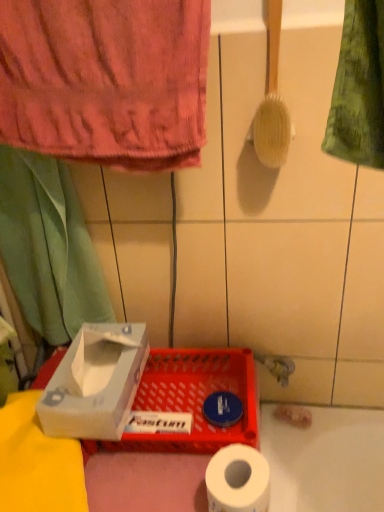
Question: Considering the relative sizes of matte plastic basket at lower center and pink cotton towel at upper left in the image provided, is matte plastic basket at lower center smaller than pink cotton towel at upper left?

Choices:
 (A) no
 (B) yes

Answer: (A)

Question: Is matte plastic basket at lower center positioned in front of pink cotton towel at upper left?

Choices:
 (A) no
 (B) yes

Answer: (A)

Question: Considering the relative sizes of matte plastic basket at lower center and pink cotton towel at upper left in the image provided, is matte plastic basket at lower center bigger than pink cotton towel at upper left?

Choices:
 (A) no
 (B) yes

Answer: (B)

Question: Is matte plastic basket at lower center aimed at pink cotton towel at upper left?

Choices:
 (A) yes
 (B) no

Answer: (B)

Question: Considering the relative sizes of matte plastic basket at lower center and pink cotton towel at upper left in the image provided, is matte plastic basket at lower center shorter than pink cotton towel at upper left?

Choices:
 (A) no
 (B) yes

Answer: (B)

Question: In terms of size, does white cardboard box at lower left appear bigger or smaller than matte plastic basket at lower center?

Choices:
 (A) small
 (B) big

Answer: (A)

Question: From the image's perspective, is white cardboard box at lower left positioned above or below matte plastic basket at lower center?

Choices:
 (A) above
 (B) below

Answer: (A)

Question: Considering the positions of white cardboard box at lower left and matte plastic basket at lower center in the image, is white cardboard box at lower left wider or thinner than matte plastic basket at lower center?

Choices:
 (A) thin
 (B) wide

Answer: (A)

Question: From a real-world perspective, is white cardboard box at lower left above or below matte plastic basket at lower center?

Choices:
 (A) above
 (B) below

Answer: (A)

Question: From the image's perspective, is pink cotton towel at upper left located above or below white matte toilet paper at lower center?

Choices:
 (A) above
 (B) below

Answer: (A)

Question: From a real-world perspective, is pink cotton towel at upper left physically located above or below white matte toilet paper at lower center?

Choices:
 (A) below
 (B) above

Answer: (B)

Question: Considering the positions of pink cotton towel at upper left and white matte toilet paper at lower center in the image, is pink cotton towel at upper left bigger or smaller than white matte toilet paper at lower center?

Choices:
 (A) small
 (B) big

Answer: (B)

Question: In terms of height, does pink cotton towel at upper left look taller or shorter compared to white matte toilet paper at lower center?

Choices:
 (A) tall
 (B) short

Answer: (A)

Question: From the image's perspective, relative to white cardboard box at lower left, is green fabric curtain at left above or below?

Choices:
 (A) below
 (B) above

Answer: (B)

Question: Looking at the image, does green fabric curtain at left seem bigger or smaller compared to white cardboard box at lower left?

Choices:
 (A) big
 (B) small

Answer: (A)